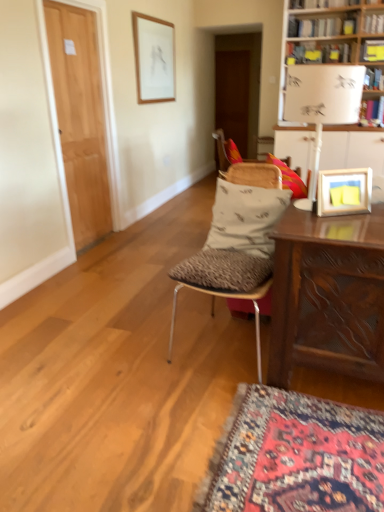
Find the location of a particular element. The image size is (384, 512). free location in front of wooden picture frame at upper right, which appears as the first picture frame when ordered from the bottom is located at coordinates [x=355, y=216].